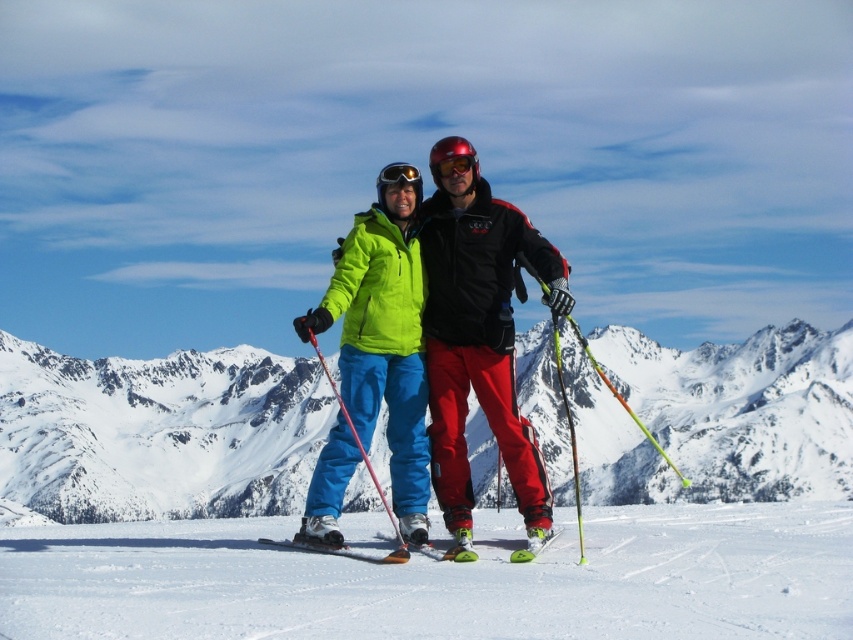
Question: Which of the following is the farthest from the observer?

Choices:
 (A) (752, 365)
 (B) (363, 250)
 (C) (402, 168)

Answer: (A)

Question: Can you confirm if snowy mountain at center is thinner than glossy plastic goggles at center?

Choices:
 (A) no
 (B) yes

Answer: (A)

Question: Can you confirm if yellow-green plastic ski at center is positioned above black matte goggles at center?

Choices:
 (A) no
 (B) yes

Answer: (A)

Question: Among these objects, which one is nearest to the camera?

Choices:
 (A) green matte ski at center
 (B) white snow at center
 (C) neon green jacket at center

Answer: (B)

Question: Estimate the real-world distances between objects in this image. Which object is farther from the yellow-green plastic ski at center?

Choices:
 (A) neon green jacket at center
 (B) white snow at center

Answer: (B)

Question: Is yellow-green plastic ski at center thinner than black matte goggles at center?

Choices:
 (A) no
 (B) yes

Answer: (B)